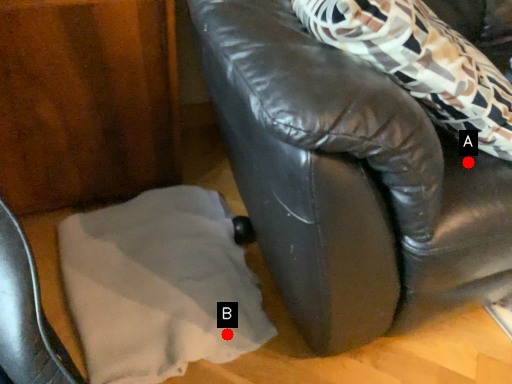
Question: Two points are circled on the image, labeled by A and B beside each circle. Which point is closer to the camera?

Choices:
 (A) A is closer
 (B) B is closer

Answer: (A)